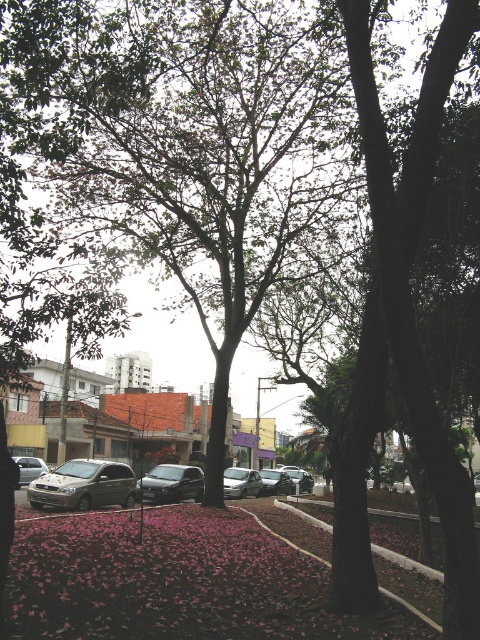
Question: Which point appears closest to the camera in this image?

Choices:
 (A) (297, 490)
 (B) (107, 474)
 (C) (162, 470)

Answer: (B)

Question: Which point is closer to the camera?

Choices:
 (A) satin silver car at center
 (B) satin black car at center

Answer: (B)

Question: Is shiny silver sedan at center bigger than silver metallic sedan at center?

Choices:
 (A) yes
 (B) no

Answer: (B)

Question: Can you confirm if satin silver car at center is positioned below metallic silver sedan at center?

Choices:
 (A) yes
 (B) no

Answer: (B)

Question: Is pink matte petals at lower center below silver metallic sedan at center?

Choices:
 (A) yes
 (B) no

Answer: (B)

Question: Which point is closer to the camera taking this photo?

Choices:
 (A) (26, 476)
 (B) (299, 483)
 (C) (160, 500)
 (D) (244, 476)

Answer: (C)